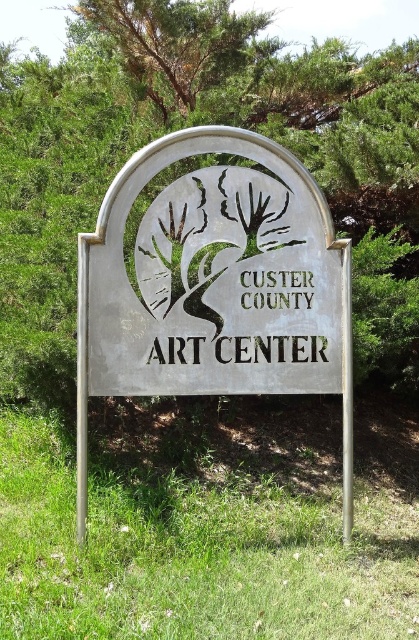
Question: Does metallic silver sign at center appear over green leafy tree at upper center?

Choices:
 (A) no
 (B) yes

Answer: (A)

Question: Among these objects, which one is nearest to the camera?

Choices:
 (A) metallic silver sign at center
 (B) green leafy tree at upper center
 (C) green grass at lower center

Answer: (C)

Question: Which of the following is the closest to the observer?

Choices:
 (A) green leafy tree at upper center
 (B) green grass at lower center
 (C) metallic silver sign at center

Answer: (B)

Question: Which object is farther from the camera taking this photo?

Choices:
 (A) green grass at lower center
 (B) green leafy tree at upper center
 (C) metallic silver sign at center

Answer: (B)

Question: Can you confirm if metallic silver sign at center is positioned above green leafy tree at upper center?

Choices:
 (A) no
 (B) yes

Answer: (A)

Question: Is metallic silver sign at center further to camera compared to green leafy tree at upper center?

Choices:
 (A) no
 (B) yes

Answer: (A)